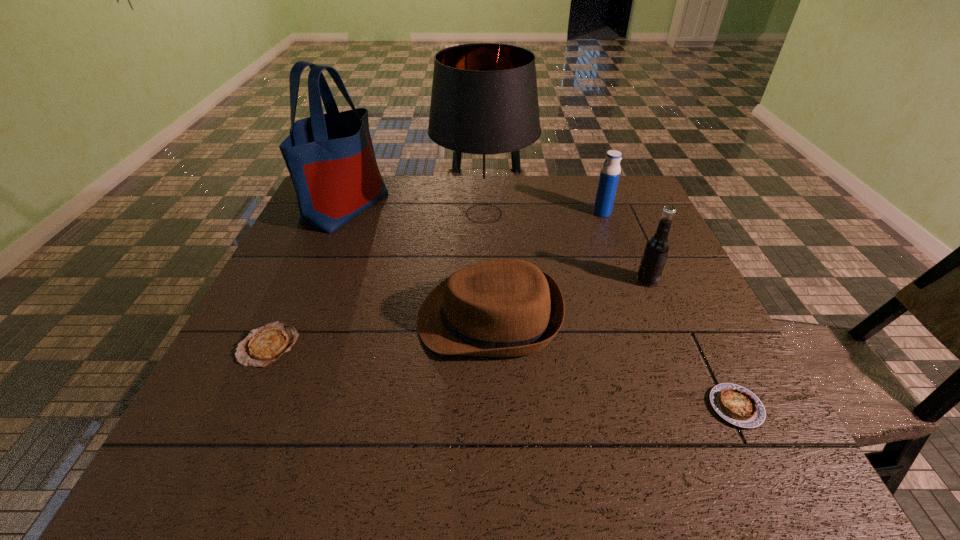
I want to click on lampshade, so click(484, 110).

Identify the location of handbag. This screenshot has height=540, width=960. (330, 157).

This screenshot has height=540, width=960. Find the location of `root beer`. root beer is located at coordinates (657, 248).

The height and width of the screenshot is (540, 960). Find the location of `water bottle`. water bottle is located at coordinates pos(610,171).

In order to click on the third shortest object in this screenshot , I will do `click(500, 308)`.

In order to click on the right quiche in this screenshot , I will do `click(737, 405)`.

Where is `the nearest object`? This screenshot has height=540, width=960. the nearest object is located at coordinates (737, 405).

The width and height of the screenshot is (960, 540). I want to click on the farther quiche, so click(x=264, y=345).

At what (x,y) coordinates should I click in order to perform the action: click on the shorter quiche. Please return your answer as a coordinate pair (x, y). Looking at the image, I should click on (264, 345).

Image resolution: width=960 pixels, height=540 pixels. Find the location of `free space located 0.240m on the front of the lampshade`. free space located 0.240m on the front of the lampshade is located at coordinates (485, 305).